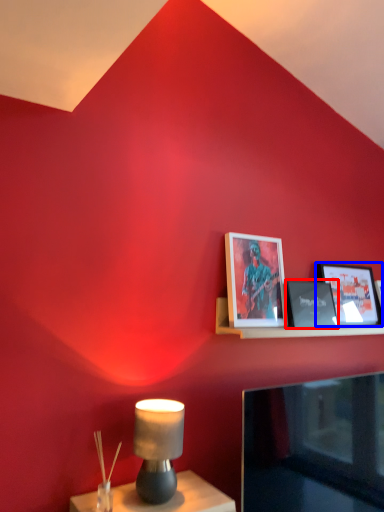
Question: Which point is closer to the camera, picture frame (highlighted by a red box) or picture frame (highlighted by a blue box)?

Choices:
 (A) picture frame
 (B) picture frame

Answer: (A)